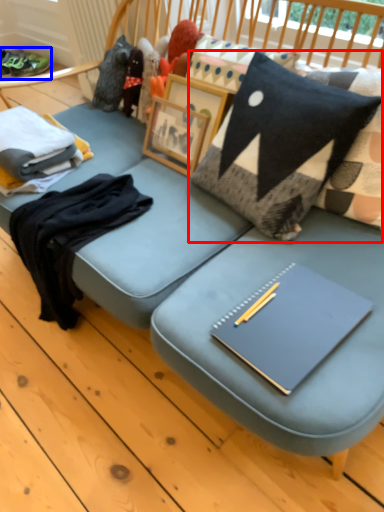
Question: Which of the following is the farthest to the observer, pillow (highlighted by a red box) or footwear (highlighted by a blue box)?

Choices:
 (A) pillow
 (B) footwear

Answer: (B)